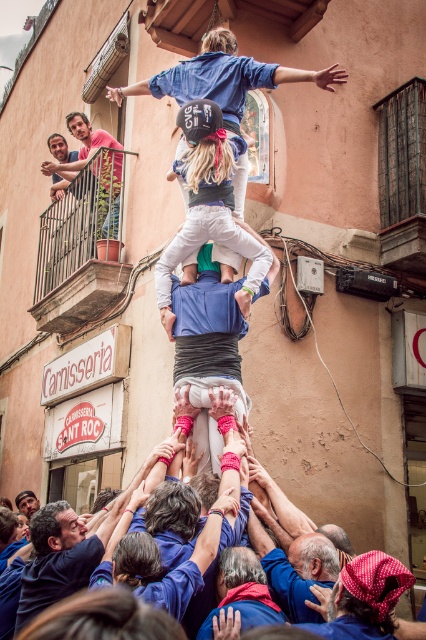
Question: Is blue fabric hands at center to the right of light brown wooden railing at upper left from the viewer's perspective?

Choices:
 (A) no
 (B) yes

Answer: (B)

Question: Is blue fabric shirt at center bigger than light brown wooden railing at upper left?

Choices:
 (A) yes
 (B) no

Answer: (B)

Question: Is blue fabric shirt at center wider than blue fabric hands at center?

Choices:
 (A) no
 (B) yes

Answer: (A)

Question: Among these objects, which one is farthest from the camera?

Choices:
 (A) light brown wooden railing at upper left
 (B) smooth skin face at center
 (C) light blue denim pants at center

Answer: (B)

Question: Estimate the real-world distances between objects in this image. Which object is farther from the smooth skin face at center?

Choices:
 (A) light blue denim pants at center
 (B) blue fabric hands at center
 (C) blue fabric shirt at center

Answer: (A)

Question: Which of the following is the closest to the observer?

Choices:
 (A) blue fabric hands at center
 (B) smooth skin face at center

Answer: (A)